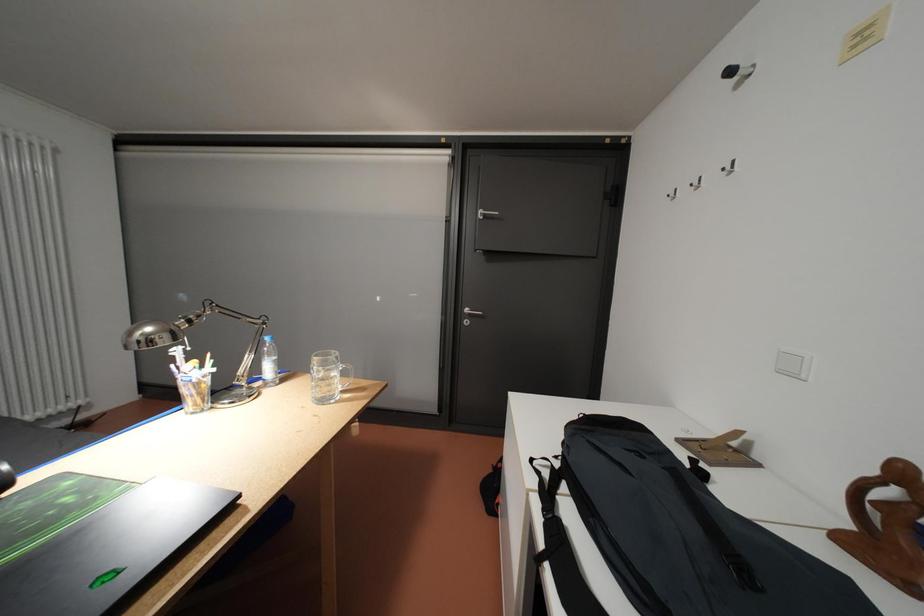
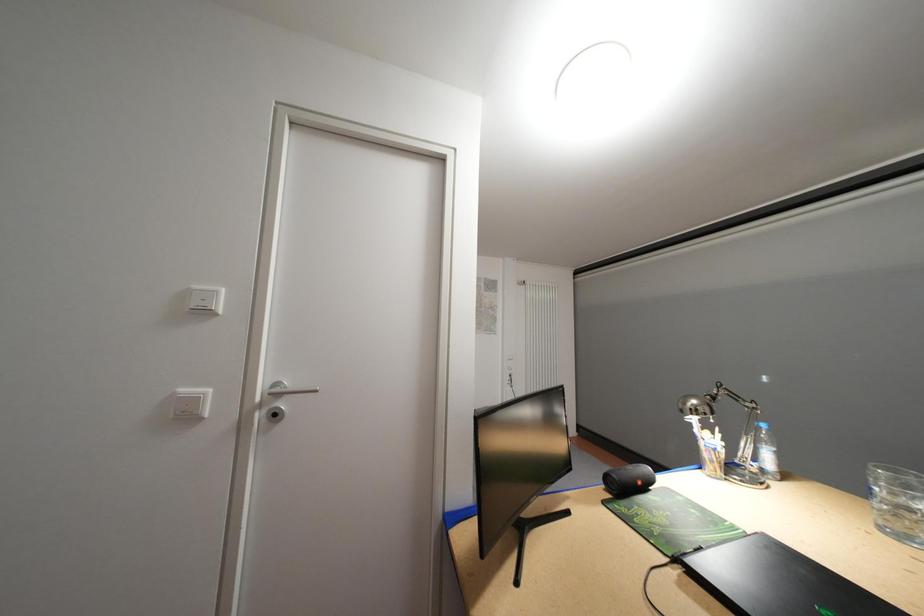
Question: The first image is from the beginning of the video and the second image is from the end. How did the camera likely rotate when shooting the video?

Choices:
 (A) Left
 (B) Right
 (C) Up
 (D) Down

Answer: (A)